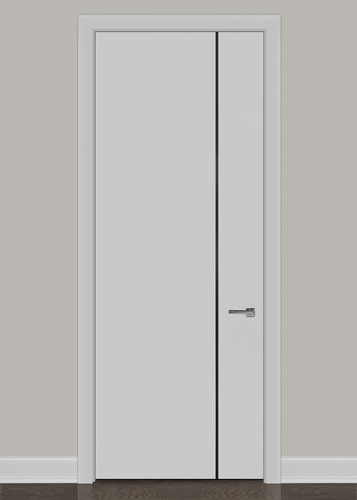
I want to click on space under door, so click(x=164, y=481).